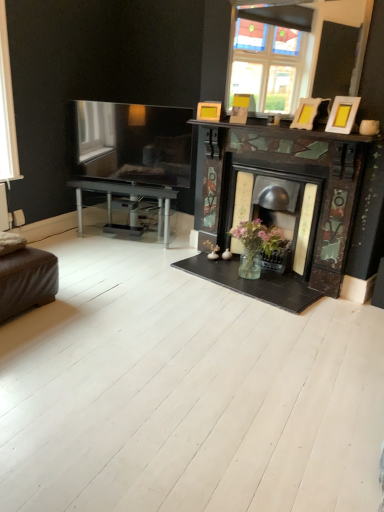
Locate an element on the screen. empty space that is to the right of brown leather ottoman at lower left is located at coordinates point(102,307).